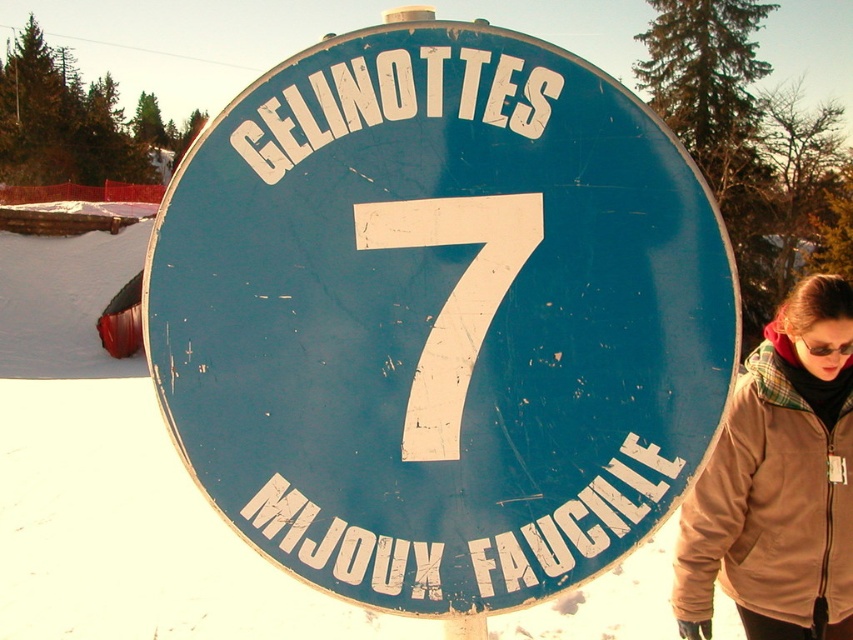
This screenshot has width=853, height=640. Identify the location of blue matte sign at center. (439, 317).

Consider the image. Does blue matte sign at center have a larger size compared to brown fleece jacket at lower right?

No, blue matte sign at center is not bigger than brown fleece jacket at lower right.

Does point (349, 166) come farther from viewer compared to point (727, 552)?

No, it is not.

The width and height of the screenshot is (853, 640). I want to click on blue matte sign at center, so (439, 317).

Does blue matte sign at center appear on the right side of black plastic goggles at center?

Incorrect, blue matte sign at center is not on the right side of black plastic goggles at center.

The width and height of the screenshot is (853, 640). Describe the element at coordinates (439, 317) in the screenshot. I see `blue matte sign at center` at that location.

The width and height of the screenshot is (853, 640). I want to click on blue matte sign at center, so click(x=439, y=317).

Based on the photo, is brown fleece jacket at lower right positioned behind black plastic goggles at center?

That is False.

What do you see at coordinates (776, 488) in the screenshot?
I see `brown fleece jacket at lower right` at bounding box center [776, 488].

At what (x,y) coordinates should I click in order to perform the action: click on brown fleece jacket at lower right. Please return your answer as a coordinate pair (x, y). The height and width of the screenshot is (640, 853). Looking at the image, I should click on (776, 488).